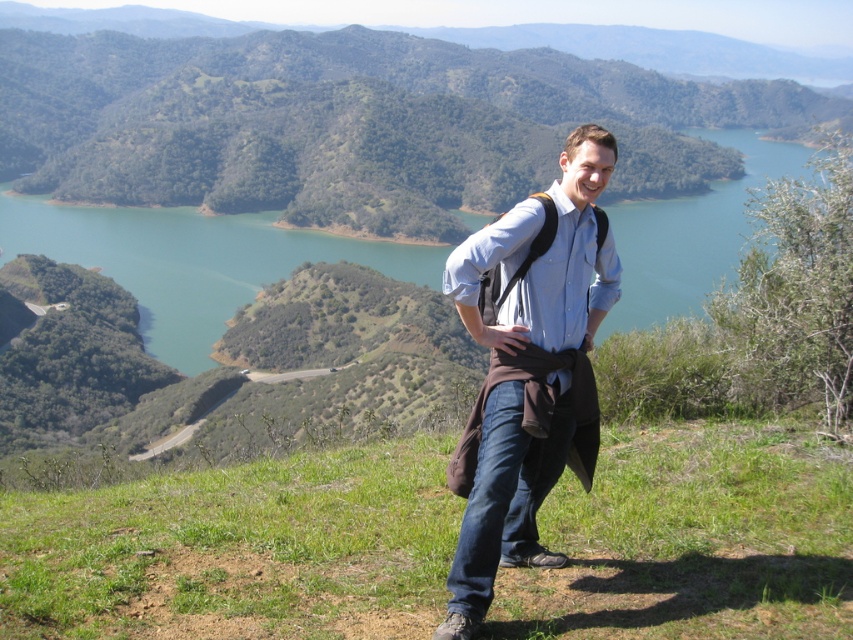
Can you confirm if green grassy hill at center is thinner than blue cotton shirt at center?

Incorrect, green grassy hill at center's width is not less than blue cotton shirt at center's.

In the scene shown: Who is more forward, [544,145] or [473,620]?

Positioned in front is point [473,620].

You are a GUI agent. You are given a task and a screenshot of the screen. Output one action in this format:
    pyautogui.click(x=<x>, y=<y>)
    Task: Click on the green grassy hill at center
    This screenshot has height=640, width=853.
    Given the screenshot: What is the action you would take?
    pyautogui.click(x=352, y=124)